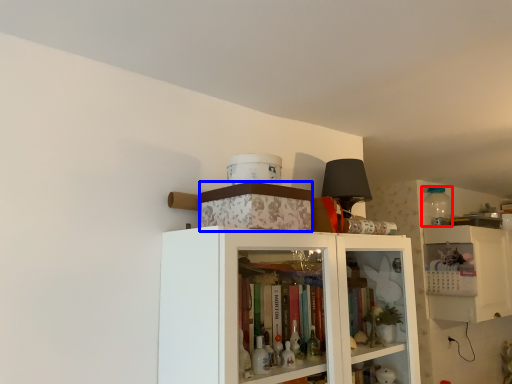
Question: Which object appears closest to the camera in this image, bottle (highlighted by a red box) or box (highlighted by a blue box)?

Choices:
 (A) bottle
 (B) box

Answer: (B)